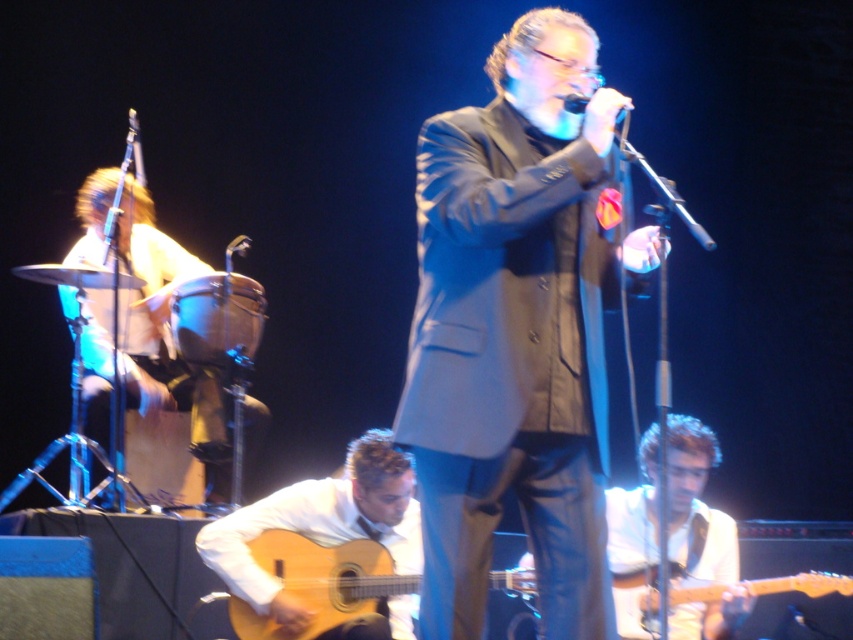
You are a photographer at the concert. You want to capture a photo that includes both the light brown wood guitar at center and the metallic silver microphone at upper center. Based on their positions, which object should you focus on first to ensure both are in frame?

The light brown wood guitar at center is below the metallic silver microphone at upper center. To include both in the frame, focus on the metallic silver microphone at upper center first as it is higher up, then adjust the camera angle downward to include the guitar below.

You are a sound technician adjusting the microphones for the band. You notice two microphones on stage. Which one is shorter, the black matte microphone at center or the metallic silver microphone at upper center?

The black matte microphone at center is shorter than the metallic silver microphone at upper center.

You are a sound technician adjusting the stage setup. You need to position a new speaker directly below the black matte microphone at center. What coordinates should you aim for?

The black matte microphone at center is located at point (575, 102), so the speaker should be placed directly below at coordinates (575, 102) plus the vertical distance downward. However, without specific vertical measurements, the exact coordinate can be estimated as maintaining the same x coordinate 0.161 and a y coordinate slightly lower than 0.675.